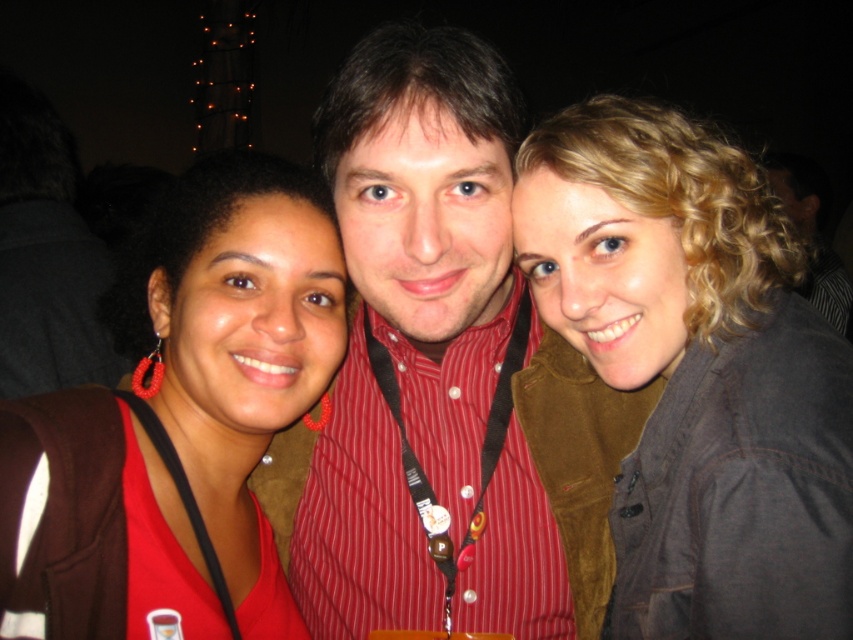
Identify the location of blonde curly hair at upper right. (697, 371).

From the picture: Is blonde curly hair at upper right to the left of matte red earrings at center from the viewer's perspective?

No, blonde curly hair at upper right is not to the left of matte red earrings at center.

Locate an element on the screen. This screenshot has height=640, width=853. blonde curly hair at upper right is located at coordinates (697, 371).

Can you confirm if blonde curly hair at upper right is positioned below red striped shirt at center?

Correct, blonde curly hair at upper right is located below red striped shirt at center.

Can you confirm if blonde curly hair at upper right is taller than red striped shirt at center?

No.

This screenshot has width=853, height=640. I want to click on blonde curly hair at upper right, so click(697, 371).

The image size is (853, 640). I want to click on blonde curly hair at upper right, so click(x=697, y=371).

Is red striped shirt at center above matte red earrings at center?

Yes.

Measure the distance between red striped shirt at center and camera.

red striped shirt at center and camera are 35.03 inches apart.

The image size is (853, 640). Identify the location of red striped shirt at center. (424, 355).